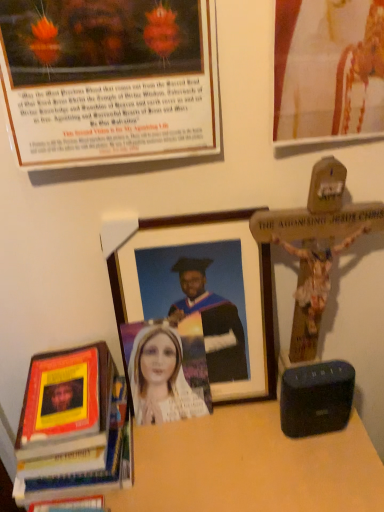
Where is `unoccupied region to the right of hardcover book at lower left`? unoccupied region to the right of hardcover book at lower left is located at coordinates (185, 456).